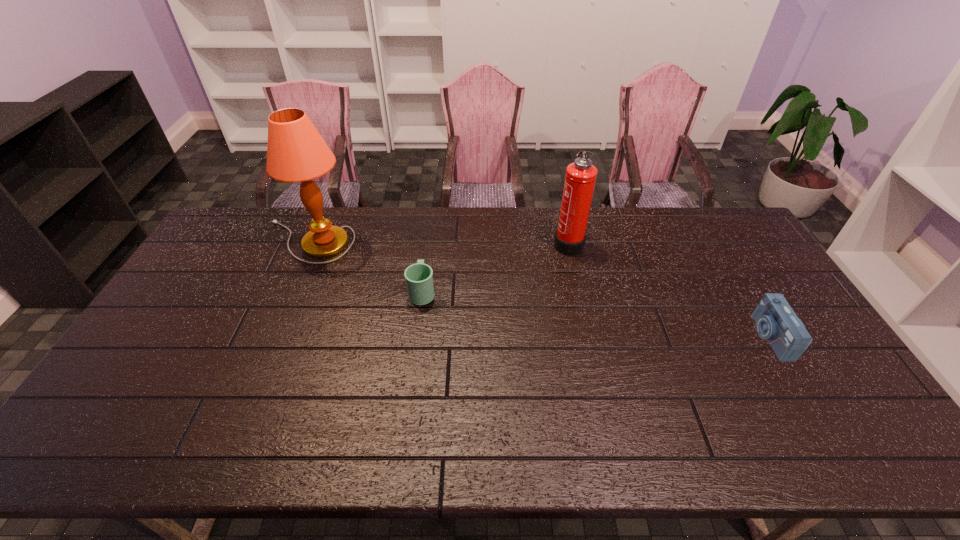
At what (x,y) coordinates should I click in order to perform the action: click on the leftmost object. Please return your answer as a coordinate pair (x, y). The image size is (960, 540). Looking at the image, I should click on (296, 152).

Locate an element on the screen. The image size is (960, 540). lamp is located at coordinates (296, 152).

I want to click on the second object from right to left, so click(x=580, y=179).

This screenshot has width=960, height=540. What are the coordinates of `fire extinguisher` in the screenshot? It's located at (580, 179).

The width and height of the screenshot is (960, 540). What are the coordinates of `the second nearest object` in the screenshot? It's located at pos(419,280).

Locate an element on the screen. Image resolution: width=960 pixels, height=540 pixels. mug is located at coordinates (419, 280).

Where is `the nearest object`? The image size is (960, 540). the nearest object is located at coordinates (776, 322).

Identify the location of the rightmost object. Image resolution: width=960 pixels, height=540 pixels. (776, 322).

Where is `free space located 0.350m on the right of the lamp`? The height and width of the screenshot is (540, 960). free space located 0.350m on the right of the lamp is located at coordinates (455, 242).

In order to click on free space located 0.100m on the front-facing side of the fire extinguisher in this screenshot , I will do `click(524, 242)`.